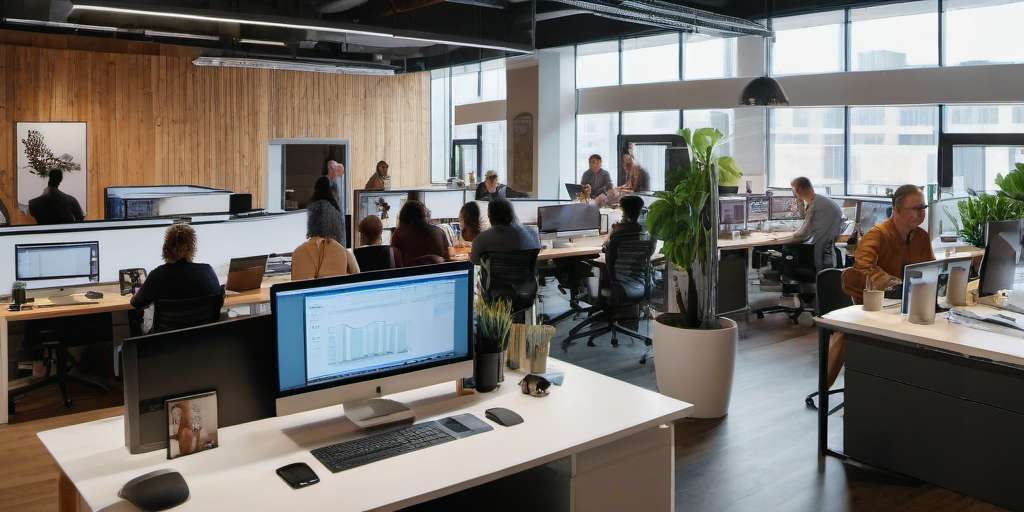
Where is `desks`? The image size is (1024, 512). desks is located at coordinates [259, 500], [113, 313], [252, 296], [572, 254], [461, 256], [753, 241], [851, 315], [848, 238].